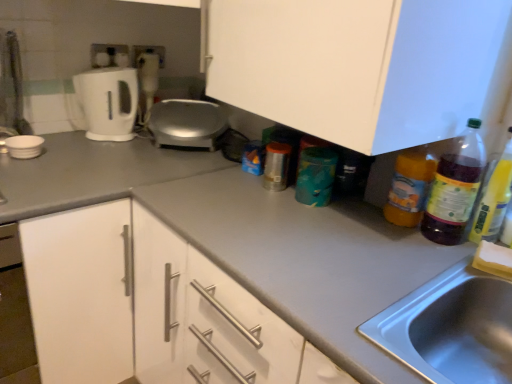
The width and height of the screenshot is (512, 384). I want to click on free space in front of satin silver appliance at center, the 1th appliance in the back-to-front sequence, so click(x=162, y=164).